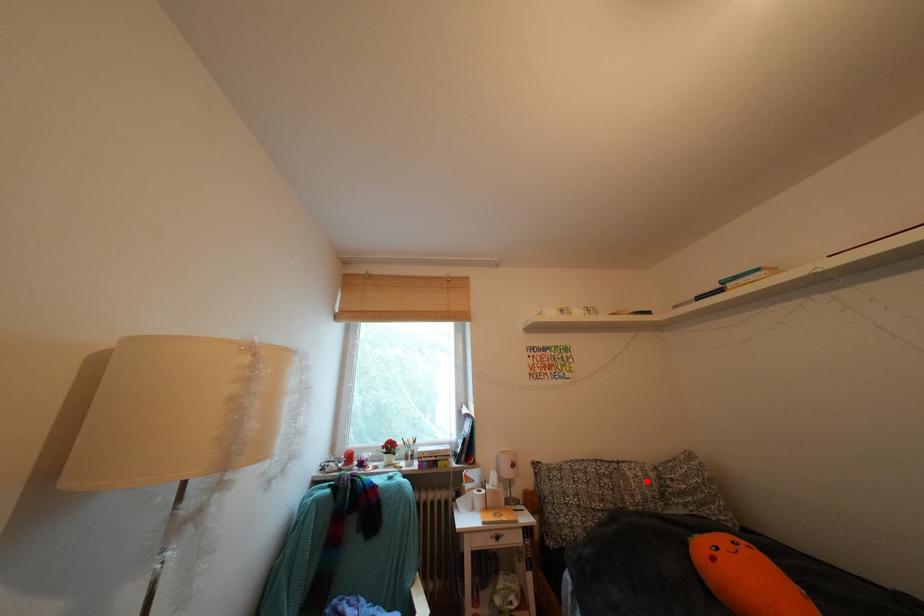
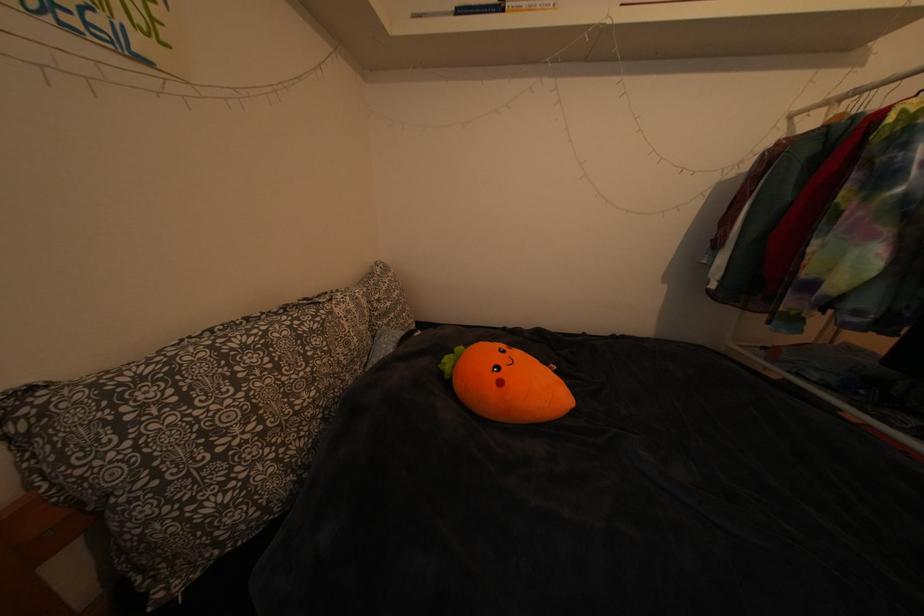
Where in the second image is the point corresponding to the highlighted location from the first image?

(359, 317)